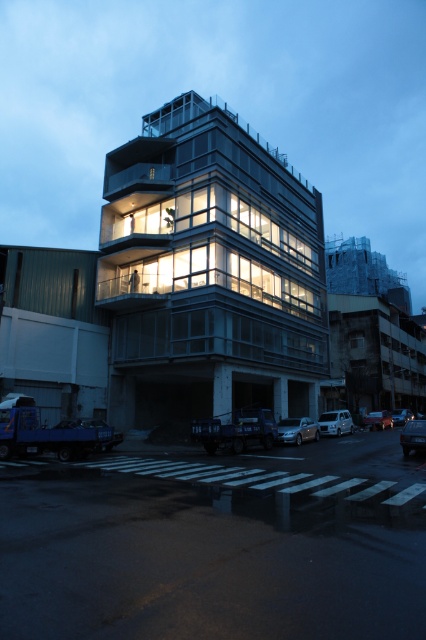
Which of these two, satin silver sedan at center or white matte van at lower right, stands shorter?

Standing shorter between the two is satin silver sedan at center.

Where is `satin silver sedan at center`? satin silver sedan at center is located at coordinates (296, 429).

Is shiny black sedan at center shorter than shiny black car at lower right?

Yes.

Which is in front, point (373, 420) or point (400, 419)?

Point (373, 420) is in front.

Where is `shiny black sedan at center`? Image resolution: width=426 pixels, height=640 pixels. shiny black sedan at center is located at coordinates (377, 419).

Looking at this image, does transparent glass building at center appear on the left side of white matte van at lower right?

Yes, transparent glass building at center is to the left of white matte van at lower right.

I want to click on transparent glass building at center, so click(x=222, y=99).